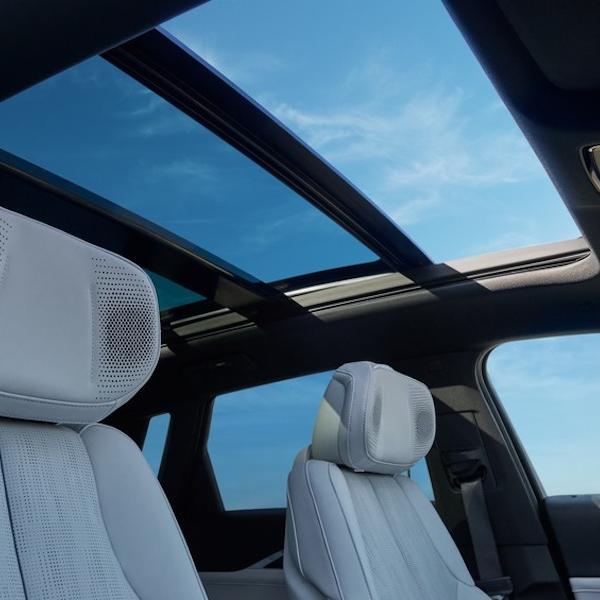
Find the location of `head rest`. head rest is located at coordinates (370, 395).